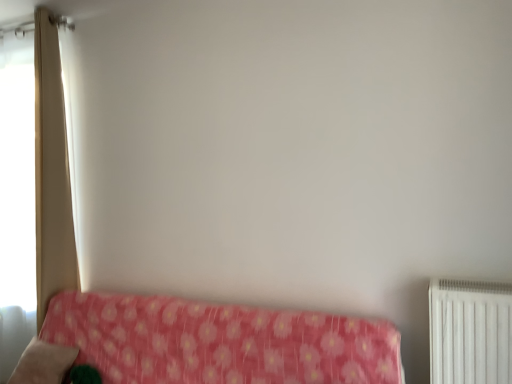
Question: Does soft pink fabric pillow at lower left turn towards beige fabric curtain at left?

Choices:
 (A) no
 (B) yes

Answer: (A)

Question: Does soft pink fabric pillow at lower left come behind beige fabric curtain at left?

Choices:
 (A) yes
 (B) no

Answer: (B)

Question: From a real-world perspective, is soft pink fabric pillow at lower left physically below beige fabric curtain at left?

Choices:
 (A) yes
 (B) no

Answer: (A)

Question: From the image's perspective, is soft pink fabric pillow at lower left located beneath beige fabric curtain at left?

Choices:
 (A) yes
 (B) no

Answer: (A)

Question: From the image's perspective, is soft pink fabric pillow at lower left on beige fabric curtain at left?

Choices:
 (A) no
 (B) yes

Answer: (A)

Question: Can you confirm if soft pink fabric pillow at lower left is positioned to the right of beige fabric curtain at left?

Choices:
 (A) yes
 (B) no

Answer: (A)

Question: Is soft pink fabric pillow at lower left oriented away from pink floral fabric at lower left?

Choices:
 (A) yes
 (B) no

Answer: (A)

Question: Does soft pink fabric pillow at lower left lie behind pink floral fabric at lower left?

Choices:
 (A) yes
 (B) no

Answer: (A)

Question: Is pink floral fabric at lower left inside soft pink fabric pillow at lower left?

Choices:
 (A) yes
 (B) no

Answer: (B)

Question: Considering the relative positions of soft pink fabric pillow at lower left and pink floral fabric at lower left in the image provided, is soft pink fabric pillow at lower left to the right of pink floral fabric at lower left from the viewer's perspective?

Choices:
 (A) no
 (B) yes

Answer: (A)

Question: Can you confirm if soft pink fabric pillow at lower left is taller than pink floral fabric at lower left?

Choices:
 (A) yes
 (B) no

Answer: (B)

Question: Considering the relative sizes of soft pink fabric pillow at lower left and pink floral fabric at lower left in the image provided, is soft pink fabric pillow at lower left bigger than pink floral fabric at lower left?

Choices:
 (A) yes
 (B) no

Answer: (B)

Question: Considering the relative sizes of beige fabric curtain at left and soft pink fabric pillow at lower left in the image provided, is beige fabric curtain at left bigger than soft pink fabric pillow at lower left?

Choices:
 (A) no
 (B) yes

Answer: (B)